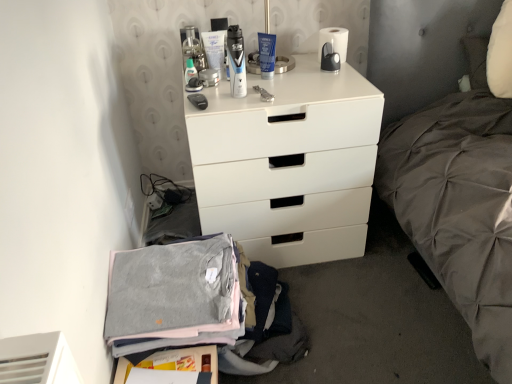
Question: Relative to gray cotton sweater at lower left, is white matte chest of drawers at center in front or behind?

Choices:
 (A) behind
 (B) front

Answer: (A)

Question: Is white matte chest of drawers at center taller or shorter than gray cotton sweater at lower left?

Choices:
 (A) short
 (B) tall

Answer: (B)

Question: Estimate the real-world distances between objects in this image. Which object is closer to the gray cotton sweater at lower left?

Choices:
 (A) white matte toilet paper at upper center
 (B) translucent plastic bottle at upper center
 (C) white matte chest of drawers at center

Answer: (C)

Question: Which object is positioned farthest from the translucent plastic bottle at upper center?

Choices:
 (A) white matte toilet paper at upper center
 (B) white matte chest of drawers at center
 (C) gray cotton sweater at lower left

Answer: (C)